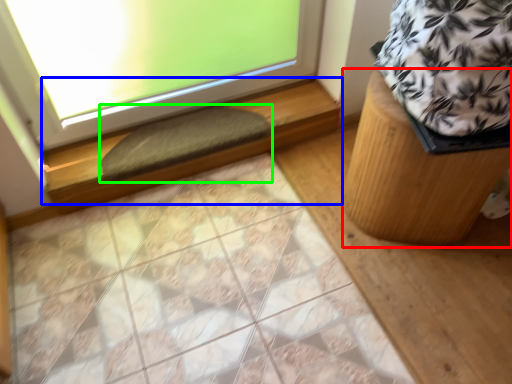
Question: Based on their relative distances, which object is nearer to furniture (highlighted by a red box)? Choose from window sill (highlighted by a blue box) and doormat (highlighted by a green box).

Choices:
 (A) window sill
 (B) doormat

Answer: (A)